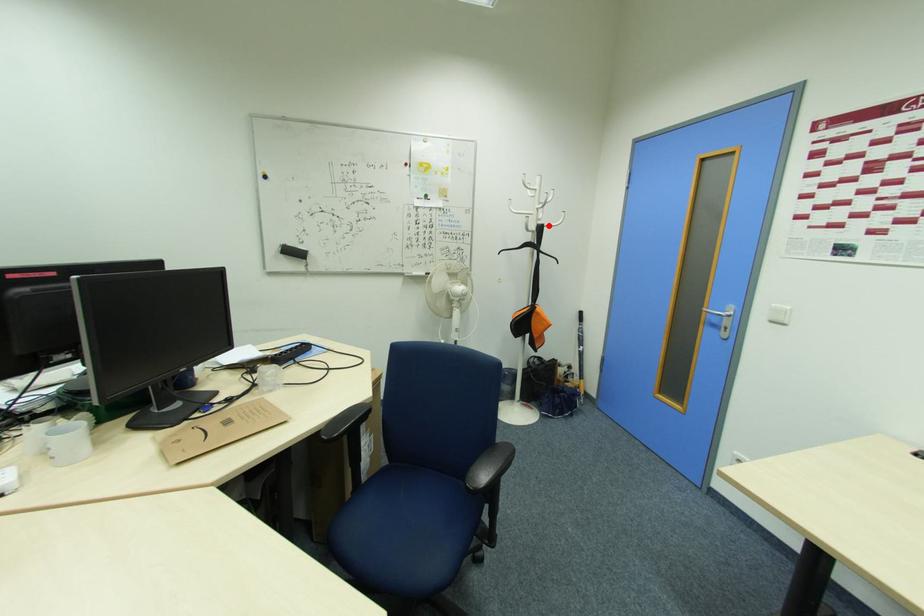
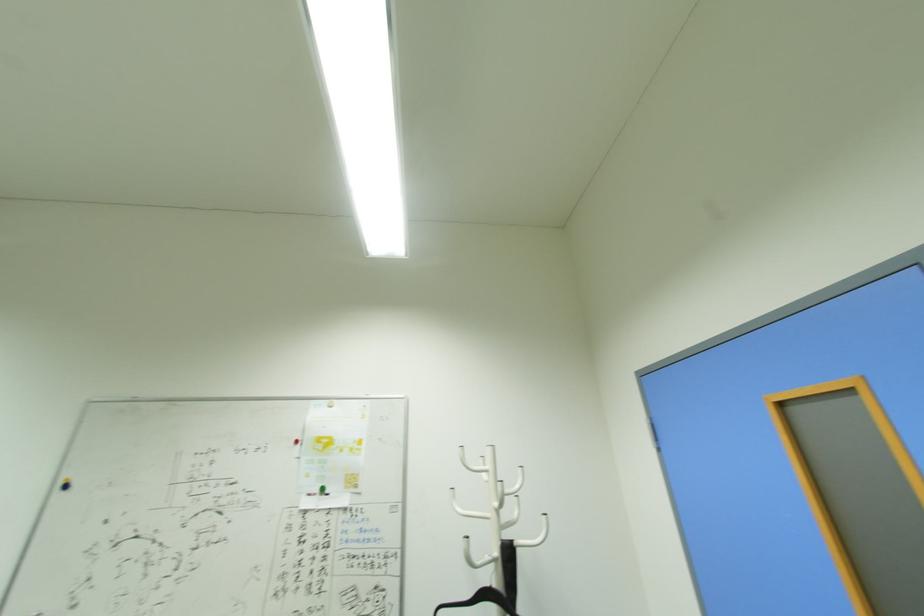
Find the pixel in the second image that matches the highlighted location in the first image.

(518, 544)